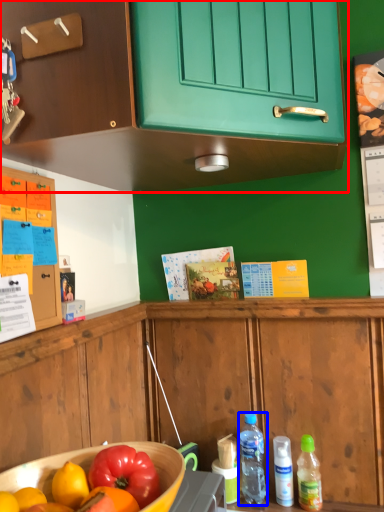
Question: Among these objects, which one is farthest to the camera, cabinetry (highlighted by a red box) or bottle (highlighted by a blue box)?

Choices:
 (A) cabinetry
 (B) bottle

Answer: (B)